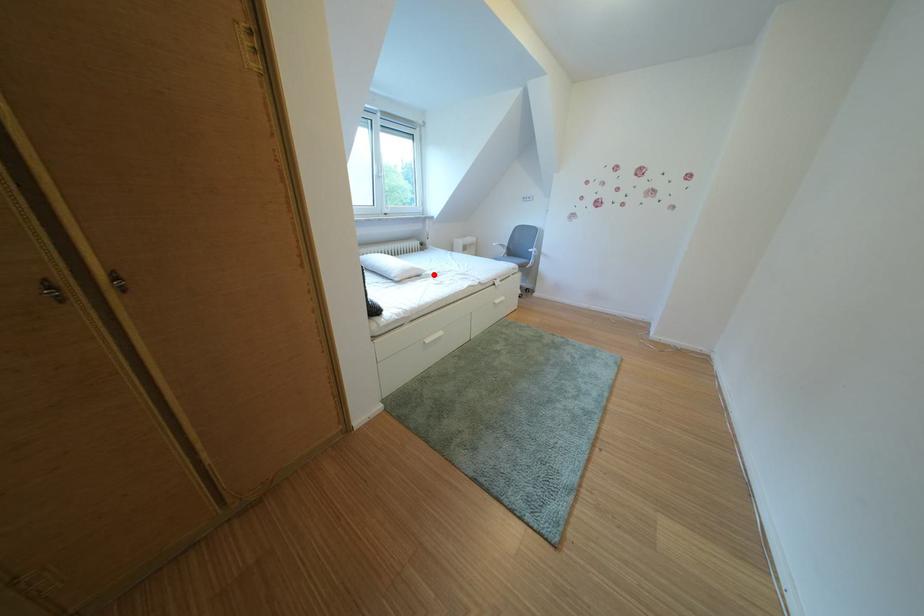
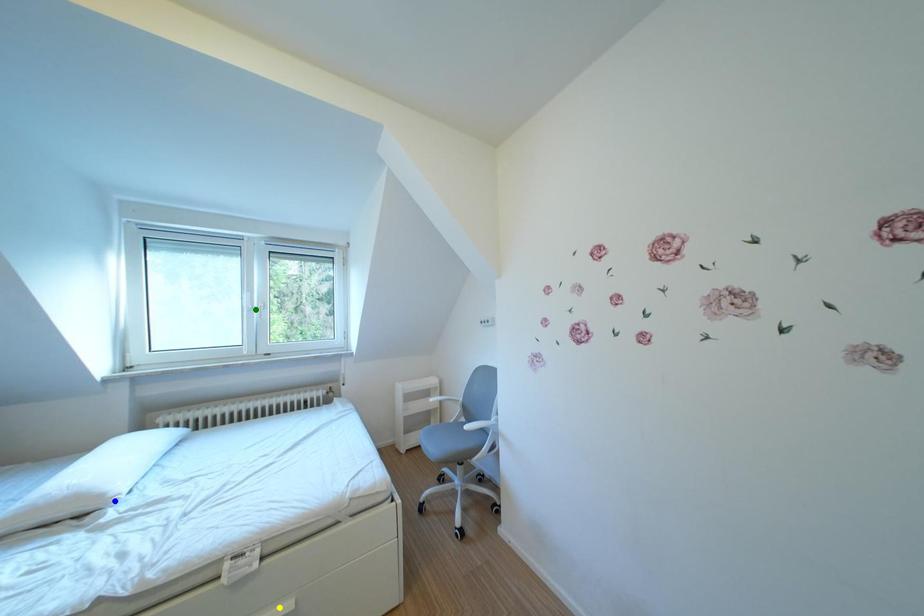
Question: I am providing you with two images of the same scene from different viewpoints. A red point is marked on the first image. You are given multiple points on the second image. Which point in image 2 represents the same 3d spot as the red point in image 1?

Choices:
 (A) green point
 (B) yellow point
 (C) blue point

Answer: (C)